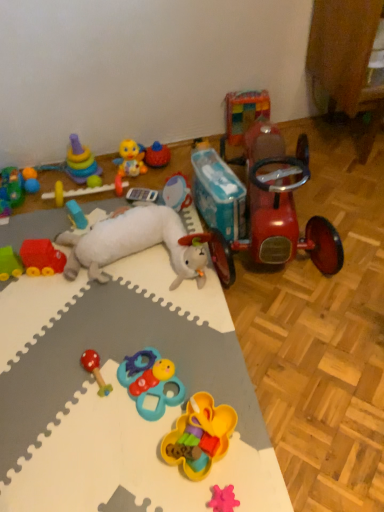
This screenshot has height=512, width=384. What are the coordinates of `free point behind blue rubber rattle at center, the sixth toy positioned from the right` in the screenshot? It's located at (157, 327).